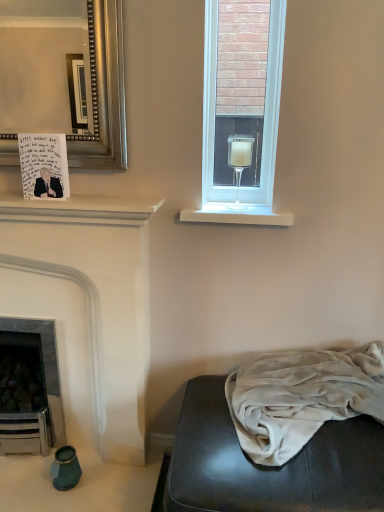
This screenshot has width=384, height=512. I want to click on vacant area on top of white matte shelf at upper left (from a real-world perspective), so click(x=79, y=199).